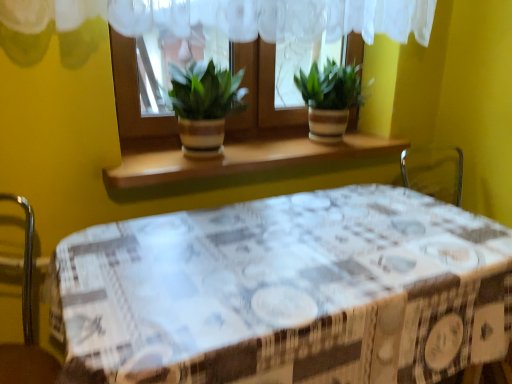
What do you see at coordinates (329, 99) in the screenshot?
I see `green striped pot at center, which ranks as the 1th houseplant in right-to-left order` at bounding box center [329, 99].

Describe the element at coordinates (204, 105) in the screenshot. I see `matte brown pot at center, the second houseplant viewed from the right` at that location.

Where is `green leafy plant at center`? The image size is (512, 384). green leafy plant at center is located at coordinates (253, 36).

Is green leafy plant at center positioned with its back to matte brown pot at center, the second houseplant viewed from the right?

Yes, green leafy plant at center's orientation is away from matte brown pot at center, the second houseplant viewed from the right.

From the image's perspective, which is above, green leafy plant at center or matte brown pot at center, the second houseplant viewed from the right?

green leafy plant at center.

Is green leafy plant at center in front of or behind matte brown pot at center, marked as the 1th houseplant in a left-to-right arrangement, in the image?

green leafy plant at center is positioned farther from the viewer than matte brown pot at center, marked as the 1th houseplant in a left-to-right arrangement.

How distant is green leafy plant at center from matte brown pot at center, marked as the 1th houseplant in a left-to-right arrangement?

green leafy plant at center is 7.09 inches from matte brown pot at center, marked as the 1th houseplant in a left-to-right arrangement.

From the image's perspective, which object appears higher, white printed tablecloth at center or green striped pot at center, which ranks as the 1th houseplant in right-to-left order?

green striped pot at center, which ranks as the 1th houseplant in right-to-left order, is shown above in the image.

Can you tell me how much white printed tablecloth at center and green striped pot at center, which is the second houseplant in left-to-right order, differ in facing direction?

0.000411 degrees.

Is white printed tablecloth at center not close to green striped pot at center, which is the second houseplant in left-to-right order?

No, white printed tablecloth at center is not far from green striped pot at center, which is the second houseplant in left-to-right order.

Is white printed tablecloth at center inside or outside of green striped pot at center, which is the second houseplant in left-to-right order?

white printed tablecloth at center is spatially situated outside green striped pot at center, which is the second houseplant in left-to-right order.

How different are the orientations of wooden at center and green leafy plant at center in degrees?

wooden at center and green leafy plant at center are facing 0.000577 degrees away from each other.

Could you tell me if wooden at center is facing green leafy plant at center?

No, wooden at center is not oriented towards green leafy plant at center.

Are wooden at center and green leafy plant at center making contact?

No, wooden at center is not next to green leafy plant at center.

Between green leafy plant at center and wooden at center, which one has smaller size?

Smaller between the two is wooden at center.

This screenshot has width=512, height=384. Identify the location of window lying on the left of wooden at center. (253, 36).

From a real-world perspective, between green leafy plant at center and wooden at center, who is vertically lower?

wooden at center is physically lower.

From the image's perspective, which is below, green leafy plant at center or wooden at center?

wooden at center, from the image's perspective.

What are the coordinates of `the 2nd houseplant above when counting from the wooden at center (from the image's perspective)` in the screenshot? It's located at (329, 99).

Is green striped pot at center, which is the second houseplant in left-to-right order, facing towards wooden at center?

No, green striped pot at center, which is the second houseplant in left-to-right order, is not aimed at wooden at center.

Is green striped pot at center, which ranks as the 1th houseplant in right-to-left order, far from wooden at center?

No.

Which is closer, (233, 97) or (159, 23)?

Point (159, 23)

From a real-world perspective, which object stands above the other?

From a 3D spatial view, green leafy plant at center is above.

Find the location of a particular element. This screenshot has width=512, height=384. houseplant in front of the green leafy plant at center is located at coordinates (204, 105).

Is matte brown pot at center, the second houseplant viewed from the right, further to camera compared to green leafy plant at center?

No, it is not.

Considering the sizes of green leafy plant at center and white printed tablecloth at center in the image, is green leafy plant at center taller or shorter than white printed tablecloth at center?

green leafy plant at center is shorter than white printed tablecloth at center.

Can you tell me how much green leafy plant at center and white printed tablecloth at center differ in facing direction?

The angle between the facing direction of green leafy plant at center and the facing direction of white printed tablecloth at center is 0.000595 degrees.

Which of these two, green leafy plant at center or white printed tablecloth at center, is bigger?

white printed tablecloth at center is bigger.

From a real-world perspective, is green leafy plant at center physically below white printed tablecloth at center?

No, from a real-world perspective, green leafy plant at center is not below white printed tablecloth at center.

Where is `window above the matte brown pot at center, marked as the 1th houseplant in a left-to-right arrangement (from a real-world perspective)`? The height and width of the screenshot is (384, 512). window above the matte brown pot at center, marked as the 1th houseplant in a left-to-right arrangement (from a real-world perspective) is located at coordinates (253, 36).

Image resolution: width=512 pixels, height=384 pixels. I want to click on table that is on the left side of green striped pot at center, which is the second houseplant in left-to-right order, so click(291, 291).

Looking at the image, which one is located closer to green striped pot at center, which ranks as the 1th houseplant in right-to-left order, green leafy plant at center or wooden at center?

wooden at center lies closer to green striped pot at center, which ranks as the 1th houseplant in right-to-left order, than the other object.

From the image, which object appears to be farther from green striped pot at center, which is the second houseplant in left-to-right order, wooden at center or green leafy plant at center?

green leafy plant at center is positioned further to the anchor green striped pot at center, which is the second houseplant in left-to-right order.

When comparing their distances from matte brown pot at center, marked as the 1th houseplant in a left-to-right arrangement, does white printed tablecloth at center or wooden at center seem closer?

wooden at center is positioned closer to the anchor matte brown pot at center, marked as the 1th houseplant in a left-to-right arrangement.

Which object lies nearer to the anchor point matte brown pot at center, the second houseplant viewed from the right, green leafy plant at center or wooden at center?

The object closer to matte brown pot at center, the second houseplant viewed from the right, is green leafy plant at center.

From the image, which object appears to be nearer to green striped pot at center, which is the second houseplant in left-to-right order, wooden at center or white printed tablecloth at center?

wooden at center lies closer to green striped pot at center, which is the second houseplant in left-to-right order, than the other object.

Which object lies further to the anchor point wooden at center, white printed tablecloth at center or matte brown pot at center, marked as the 1th houseplant in a left-to-right arrangement?

white printed tablecloth at center is positioned further to the anchor wooden at center.

When comparing their distances from white printed tablecloth at center, does green striped pot at center, which is the second houseplant in left-to-right order, or matte brown pot at center, marked as the 1th houseplant in a left-to-right arrangement, seem closer?

matte brown pot at center, marked as the 1th houseplant in a left-to-right arrangement, is positioned closer to the anchor white printed tablecloth at center.

Estimate the real-world distances between objects in this image. Which object is further from green striped pot at center, which is the second houseplant in left-to-right order, wooden at center or matte brown pot at center, marked as the 1th houseplant in a left-to-right arrangement?

matte brown pot at center, marked as the 1th houseplant in a left-to-right arrangement, is positioned further to the anchor green striped pot at center, which is the second houseplant in left-to-right order.

Locate an element on the screen. This screenshot has width=512, height=384. houseplant between white printed tablecloth at center and wooden at center from front to back is located at coordinates (204, 105).

This screenshot has height=384, width=512. I want to click on houseplant between white printed tablecloth at center and green striped pot at center, which is the second houseplant in left-to-right order, from front to back, so click(x=204, y=105).

At what (x,y) coordinates should I click in order to perform the action: click on window sill situated between green leafy plant at center and green striped pot at center, which is the second houseplant in left-to-right order, from left to right. Please return your answer as a coordinate pair (x, y). This screenshot has height=384, width=512. Looking at the image, I should click on (241, 159).

Identify the location of window sill positioned between white printed tablecloth at center and green leafy plant at center from near to far. The image size is (512, 384). (241, 159).